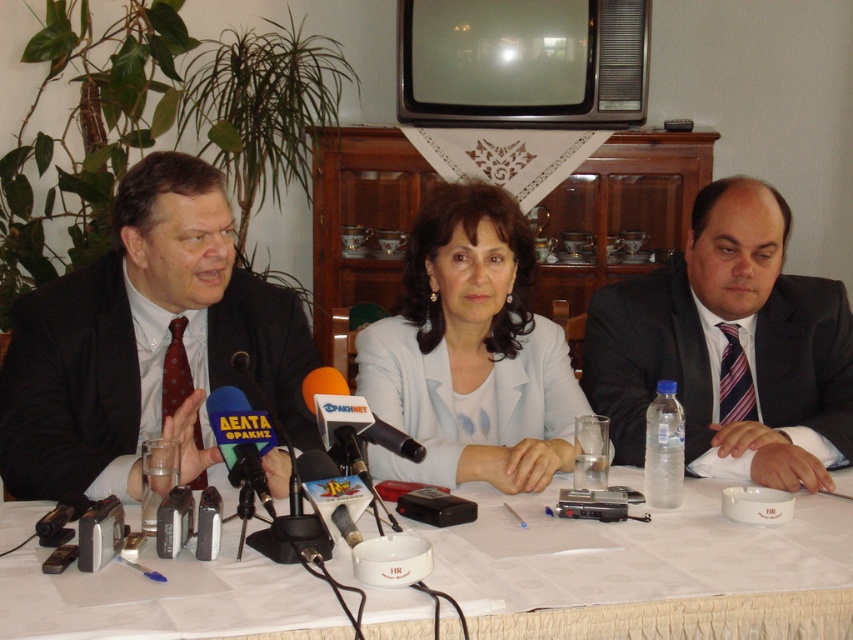
Is matte black suit at left closer to the viewer compared to orange fabric microphone at center?

No, matte black suit at left is further to the viewer.

Who is more forward, (x=265, y=461) or (x=422, y=449)?

Point (x=422, y=449)

Which is in front, point (212, 458) or point (373, 442)?

Positioned in front is point (373, 442).

The image size is (853, 640). I want to click on matte black suit at left, so click(x=144, y=342).

Does matte black suit at left have a smaller size compared to dark gray suit at right?

Actually, matte black suit at left might be larger than dark gray suit at right.

Can you confirm if matte black suit at left is thinner than dark gray suit at right?

Yes, matte black suit at left is thinner than dark gray suit at right.

Who is more distant from viewer, (28, 358) or (840, 365)?

The point (840, 365) is more distant.

The width and height of the screenshot is (853, 640). Find the location of `matte black suit at left`. matte black suit at left is located at coordinates (144, 342).

Who is more distant from viewer, (486, 253) or (320, 376)?

Point (486, 253)

Is white matte jacket at center below orange fabric microphone at center?

Incorrect, white matte jacket at center is not positioned below orange fabric microphone at center.

Who is more forward, (456, 440) or (338, 372)?

Point (338, 372)

You are a GUI agent. You are given a task and a screenshot of the screen. Output one action in this format:
    pyautogui.click(x=<x>, y=<y>)
    Task: Click on the white matte jacket at center
    The height and width of the screenshot is (640, 853).
    Given the screenshot: What is the action you would take?
    pyautogui.click(x=471, y=353)